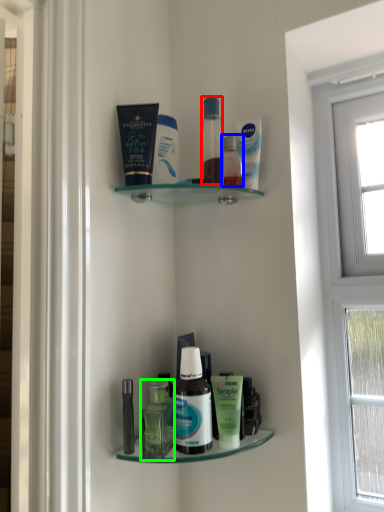
Question: Based on their relative distances, which object is farther from toiletry (highlighted by a red box)? Choose from toiletry (highlighted by a blue box) and bottle (highlighted by a green box).

Choices:
 (A) toiletry
 (B) bottle

Answer: (B)